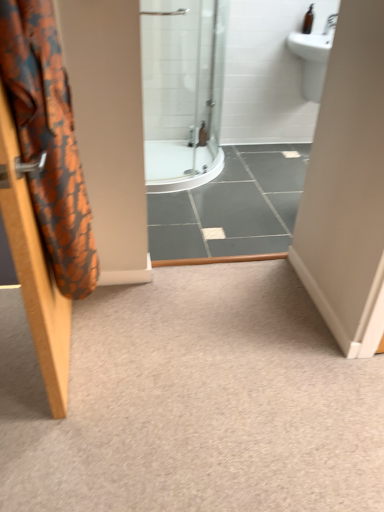
Question: From the image's perspective, is carpet at center under orange fabric shower curtain at left?

Choices:
 (A) no
 (B) yes

Answer: (B)

Question: Is carpet at center positioned far away from orange fabric shower curtain at left?

Choices:
 (A) no
 (B) yes

Answer: (A)

Question: Is the position of carpet at center less distant than that of orange fabric shower curtain at left?

Choices:
 (A) no
 (B) yes

Answer: (A)

Question: Is carpet at center located outside orange fabric shower curtain at left?

Choices:
 (A) yes
 (B) no

Answer: (A)

Question: Is carpet at center positioned behind orange fabric shower curtain at left?

Choices:
 (A) yes
 (B) no

Answer: (A)

Question: Is carpet at center smaller than orange fabric shower curtain at left?

Choices:
 (A) no
 (B) yes

Answer: (A)

Question: Can you confirm if orange fabric shower curtain at left is bigger than carpet at center?

Choices:
 (A) no
 (B) yes

Answer: (A)

Question: From the image's perspective, does orange fabric shower curtain at left appear lower than carpet at center?

Choices:
 (A) no
 (B) yes

Answer: (A)

Question: Is orange fabric shower curtain at left closer to camera compared to carpet at center?

Choices:
 (A) yes
 (B) no

Answer: (A)

Question: Can you confirm if orange fabric shower curtain at left is positioned to the left of carpet at center?

Choices:
 (A) no
 (B) yes

Answer: (B)

Question: From the image's perspective, does orange fabric shower curtain at left appear higher than carpet at center?

Choices:
 (A) no
 (B) yes

Answer: (B)

Question: From a real-world perspective, is orange fabric shower curtain at left positioned over carpet at center based on gravity?

Choices:
 (A) no
 (B) yes

Answer: (B)

Question: From the image's perspective, is brown glass bottle at upper right under orange fabric shower curtain at left?

Choices:
 (A) yes
 (B) no

Answer: (B)